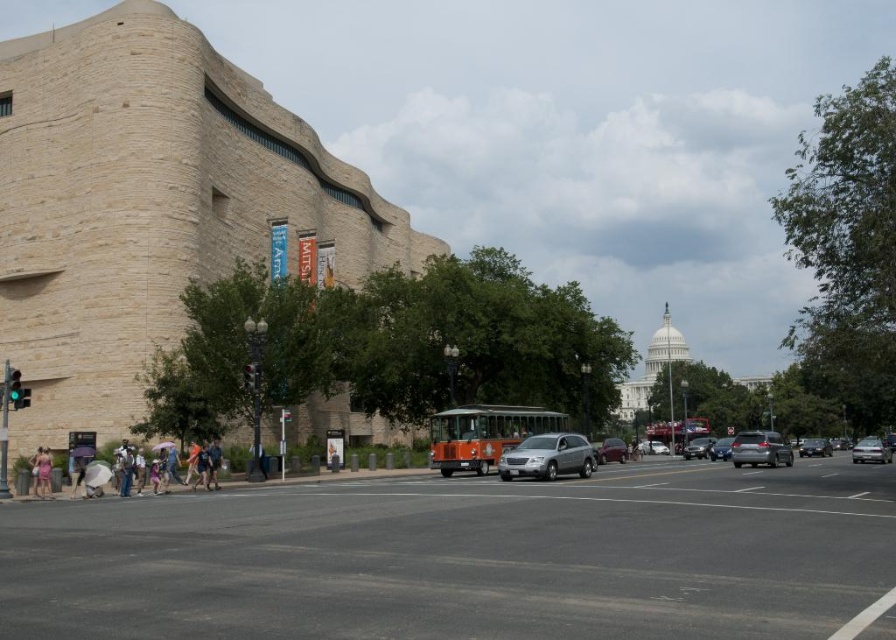
Question: Which object appears closest to the camera in this image?

Choices:
 (A) shiny silver sedan at center
 (B) pink fabric bag at lower left
 (C) silver metallic sedan at center

Answer: (B)

Question: Considering the real-world distances, which object is farthest from the silver metallic sedan at center?

Choices:
 (A) pink fabric bag at lower left
 (B) metallic silver sedan at center
 (C) shiny silver sedan at center

Answer: (B)

Question: Is beige fabric umbrella at lower left bigger than shiny silver sedan at center?

Choices:
 (A) yes
 (B) no

Answer: (B)

Question: Which point is closer to the camera taking this photo?

Choices:
 (A) (35, 461)
 (B) (625, 451)
 (C) (875, 442)

Answer: (A)

Question: Is beige fabric umbrella at lower left in front of pink fabric bag at lower left?

Choices:
 (A) yes
 (B) no

Answer: (A)

Question: Is metallic silver sedan at center wider than shiny silver sedan at center?

Choices:
 (A) yes
 (B) no

Answer: (A)